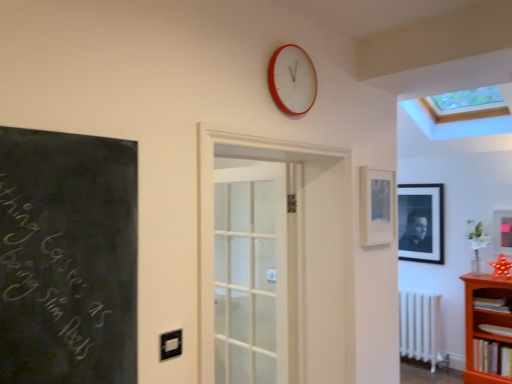
Question: Does red plastic wall clock at upper center have a greater height compared to matte black picture frame at right, the second picture frame positioned from the front?

Choices:
 (A) yes
 (B) no

Answer: (B)

Question: From a real-world perspective, is red plastic wall clock at upper center on top of matte black picture frame at right, the second picture frame positioned from the front?

Choices:
 (A) no
 (B) yes

Answer: (B)

Question: Can we say red plastic wall clock at upper center lies outside matte black picture frame at right, which is the 2th picture frame from back to front?

Choices:
 (A) no
 (B) yes

Answer: (B)

Question: Is there a large distance between red plastic wall clock at upper center and matte black picture frame at right, the 1th picture frame from the right?

Choices:
 (A) no
 (B) yes

Answer: (B)

Question: Can you confirm if red plastic wall clock at upper center is shorter than matte black picture frame at right, the second picture frame positioned from the front?

Choices:
 (A) no
 (B) yes

Answer: (B)

Question: Visually, is red plastic wall clock at upper center positioned to the left or to the right of orange wood bookshelf at lower right?

Choices:
 (A) left
 (B) right

Answer: (A)

Question: Is red plastic wall clock at upper center in front of or behind orange wood bookshelf at lower right in the image?

Choices:
 (A) front
 (B) behind

Answer: (A)

Question: Do you think red plastic wall clock at upper center is within orange wood bookshelf at lower right, or outside of it?

Choices:
 (A) outside
 (B) inside

Answer: (A)

Question: From the image's perspective, relative to orange wood bookshelf at lower right, is red plastic wall clock at upper center above or below?

Choices:
 (A) above
 (B) below

Answer: (A)

Question: From a real-world perspective, is matte black picture frame at upper right, the third picture frame from the back, physically located above or below hardcover book at lower right, which is counted as the 3th book, starting from the bottom?

Choices:
 (A) above
 (B) below

Answer: (A)

Question: Looking at the image, does matte black picture frame at upper right, the 1th picture frame from the front, seem bigger or smaller compared to hardcover book at lower right, acting as the first book starting from the top?

Choices:
 (A) small
 (B) big

Answer: (A)

Question: In the image, is matte black picture frame at upper right, which appears as the 3th picture frame when viewed from the right, on the left side or the right side of hardcover book at lower right, which is counted as the 3th book, starting from the bottom?

Choices:
 (A) left
 (B) right

Answer: (A)

Question: Relative to hardcover book at lower right, which is counted as the 3th book, starting from the bottom, is matte black picture frame at upper right, which appears as the 3th picture frame when viewed from the right, in front or behind?

Choices:
 (A) front
 (B) behind

Answer: (A)

Question: Is black matte picture frame at upper right, the third picture frame from the front, spatially inside hardcover book at lower right, positioned as the third book in top-to-bottom order, or outside of it?

Choices:
 (A) outside
 (B) inside

Answer: (A)

Question: In terms of size, does black matte picture frame at upper right, the third picture frame from the front, appear bigger or smaller than hardcover book at lower right, marked as the 1th book in a bottom-to-top arrangement?

Choices:
 (A) big
 (B) small

Answer: (A)